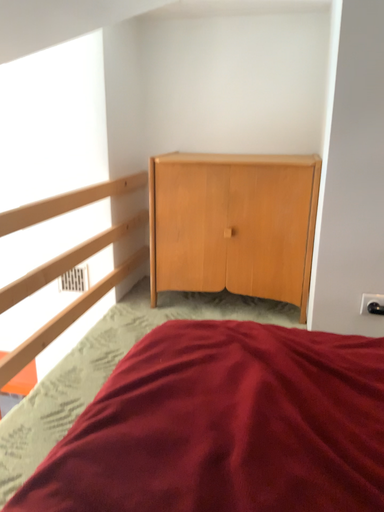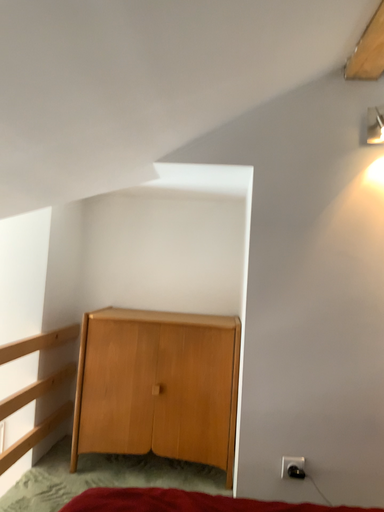
Question: How did the camera likely rotate when shooting the video?

Choices:
 (A) rotated right
 (B) rotated left

Answer: (A)